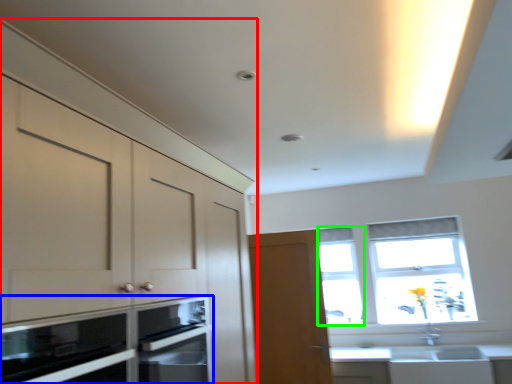
Question: Which object is positioned closest to cabinetry (highlighted by a red box)? Select from microwave oven (highlighted by a blue box) and window (highlighted by a green box).

Choices:
 (A) microwave oven
 (B) window

Answer: (A)